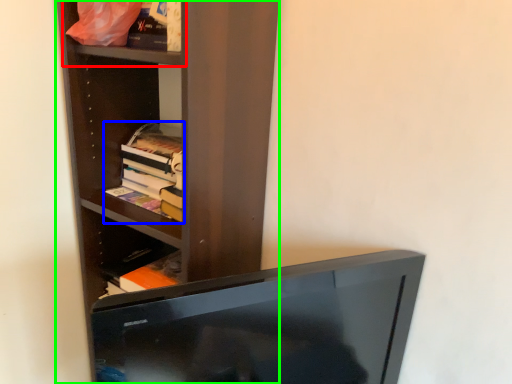
Question: Estimate the real-world distances between objects in this image. Which object is farther from cabinet (highlighted by a red box), book (highlighted by a blue box) or shelf (highlighted by a green box)?

Choices:
 (A) book
 (B) shelf

Answer: (A)